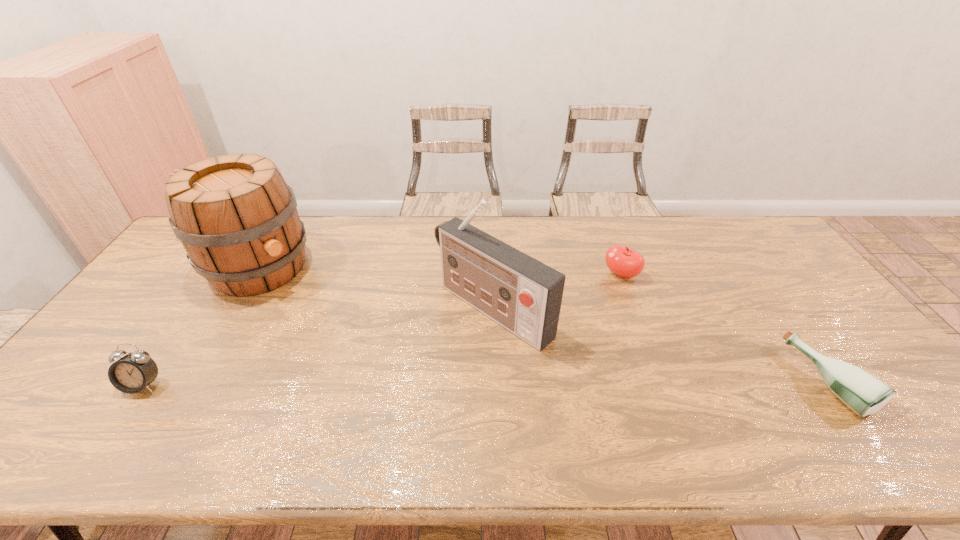
This screenshot has width=960, height=540. Identify the location of cider present at the left edge. (237, 220).

Locate an element on the screen. The height and width of the screenshot is (540, 960). object located in the right edge section of the desktop is located at coordinates (863, 393).

Locate an element on the screen. This screenshot has height=540, width=960. object at the far left corner is located at coordinates (237, 220).

This screenshot has height=540, width=960. Find the location of `object that is at the near left corner`. object that is at the near left corner is located at coordinates (132, 373).

Find the location of a particular element. Image resolution: width=960 pixels, height=540 pixels. object that is at the near right corner is located at coordinates (863, 393).

Locate an element on the screen. The height and width of the screenshot is (540, 960). vacant space at the far edge of the desktop is located at coordinates (559, 235).

You are a GUI agent. You are given a task and a screenshot of the screen. Output one action in this format:
    pyautogui.click(x=<x>, y=<y>)
    Task: Click on the free space at the near edge of the desktop
    The image size is (960, 540).
    Given the screenshot: What is the action you would take?
    pyautogui.click(x=343, y=406)

You are a GUI agent. You are given a task and a screenshot of the screen. Output one action in this format:
    pyautogui.click(x=<x>, y=<y>)
    Task: Click on the vacant space at the left edge
    Image resolution: width=960 pixels, height=540 pixels.
    Given the screenshot: What is the action you would take?
    pyautogui.click(x=172, y=262)

Identify the location of vacant space at the right edge of the desktop. (830, 329).

This screenshot has width=960, height=540. In order to click on unoccupied position between the rightmost object and the apple in this screenshot , I will do `click(725, 328)`.